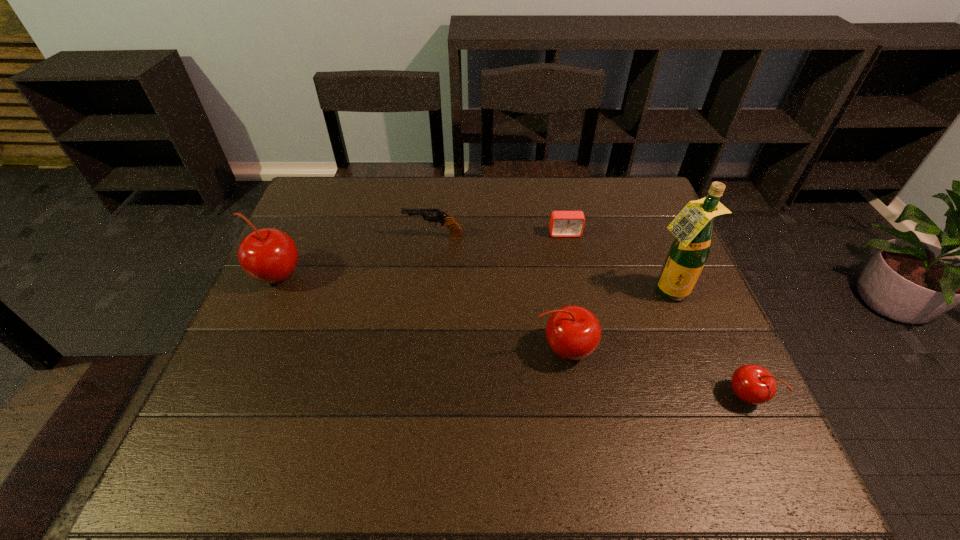
Find the location of a particular element. free space for an extra cherry to achieve even spacing is located at coordinates (410, 310).